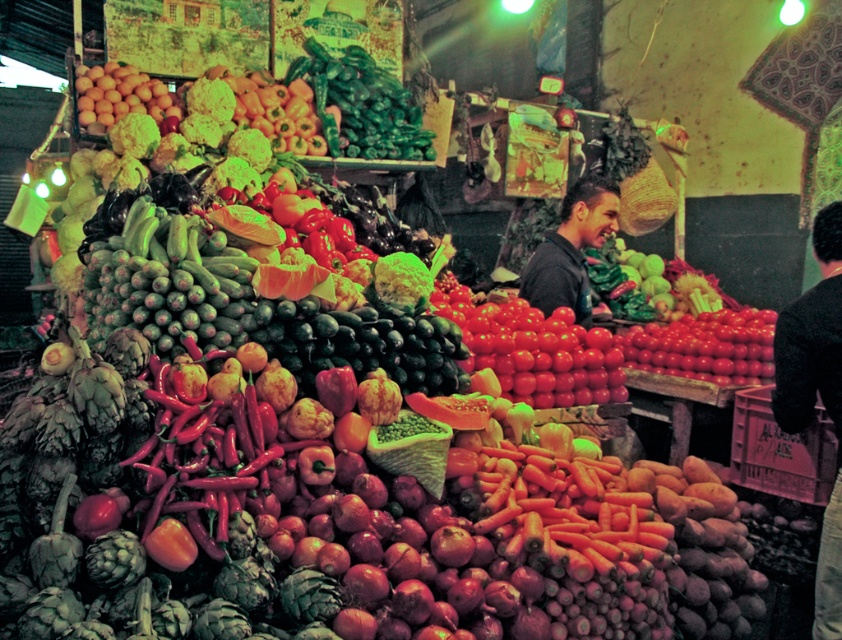
Question: Can you confirm if glossy red tomatoes at center is thinner than smooth yellow oranges at upper left?

Choices:
 (A) no
 (B) yes

Answer: (A)

Question: Which point is closer to the camera taking this photo?

Choices:
 (A) (773, 321)
 (B) (265, 436)

Answer: (B)

Question: Is smooth red chili pepper at center to the right of glossy red tomatoes at center from the viewer's perspective?

Choices:
 (A) no
 (B) yes

Answer: (A)

Question: Which object is the closest to the glossy red tomatoes at center?

Choices:
 (A) black sweater at right
 (B) smooth yellow oranges at upper left
 (C) shiny red tomatoes at center
 (D) smooth red chili pepper at center

Answer: (C)

Question: Is smooth red chili pepper at center further to camera compared to smooth yellow oranges at upper left?

Choices:
 (A) yes
 (B) no

Answer: (B)

Question: Which point is closer to the camera taking this photo?

Choices:
 (A) (364, 141)
 (B) (531, 554)
 (C) (109, 99)

Answer: (B)